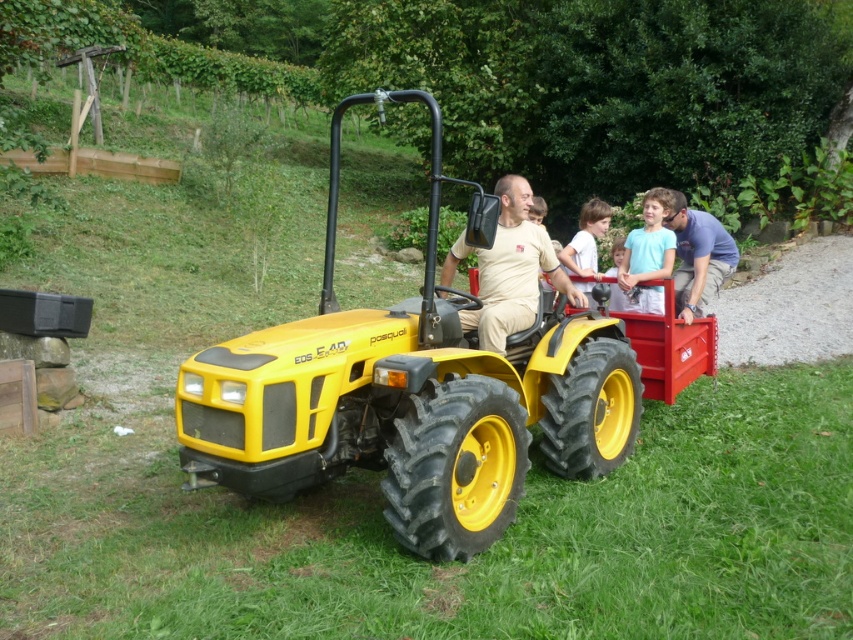
How much distance is there between blue cotton shirt at right and light brown hair at center?

blue cotton shirt at right is 35.25 inches from light brown hair at center.

The width and height of the screenshot is (853, 640). What do you see at coordinates (698, 257) in the screenshot?
I see `blue cotton shirt at right` at bounding box center [698, 257].

Describe the element at coordinates (698, 257) in the screenshot. The width and height of the screenshot is (853, 640). I see `blue cotton shirt at right` at that location.

At what (x,y) coordinates should I click in order to perform the action: click on blue cotton shirt at right. Please return your answer as a coordinate pair (x, y). This screenshot has width=853, height=640. Looking at the image, I should click on (698, 257).

Is point (680, 308) positioned before point (636, 240)?

Yes.

Is point (691, 262) positioned behind point (656, 264)?

That is True.

Where is `blue cotton shirt at right`? blue cotton shirt at right is located at coordinates (698, 257).

Which is in front, point (549, 278) or point (709, 214)?

Point (549, 278)

Is matte beige shirt at center smaller than blue cotton shirt at right?

No, matte beige shirt at center is not smaller than blue cotton shirt at right.

Describe the element at coordinates (509, 269) in the screenshot. The width and height of the screenshot is (853, 640). I see `matte beige shirt at center` at that location.

Find the location of a particular element. matte beige shirt at center is located at coordinates (509, 269).